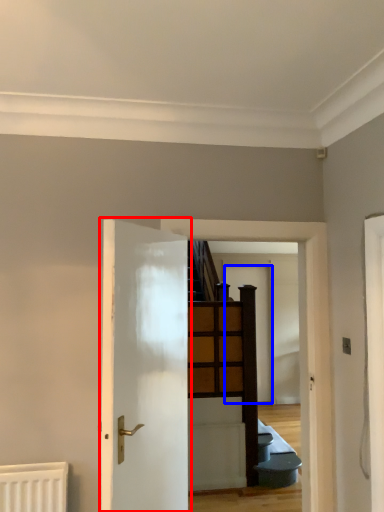
Question: Among these objects, which one is nearest to the camera, door (highlighted by a red box) or door (highlighted by a blue box)?

Choices:
 (A) door
 (B) door

Answer: (A)